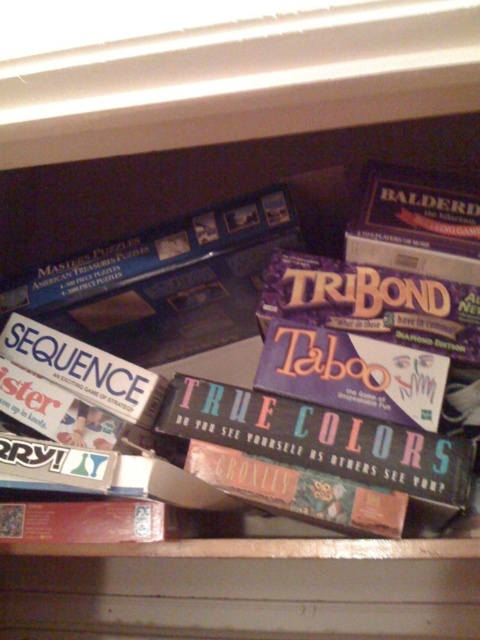
Question: Which of these objects is positioned closest to the brown cardboard box at center?

Choices:
 (A) matte cardboard true colors at center
 (B) purple cardboard game at center
 (C) matte purple board game at center

Answer: (A)

Question: Which object appears farthest from the camera in this image?

Choices:
 (A) matte cardboard true colors at center
 (B) matte purple board game at center
 (C) purple cardboard game at center
 (D) brown cardboard box at center

Answer: (C)

Question: From the image, what is the correct spatial relationship of purple cardboard game at center in relation to matte purple board game at center?

Choices:
 (A) right
 (B) left

Answer: (B)

Question: Is matte purple board game at center to the left of brown cardboard box at center from the viewer's perspective?

Choices:
 (A) no
 (B) yes

Answer: (A)

Question: Does purple cardboard game at center appear over matte purple board game at center?

Choices:
 (A) yes
 (B) no

Answer: (A)

Question: Which of the following is the farthest from the observer?

Choices:
 (A) matte cardboard true colors at center
 (B) matte purple board game at center
 (C) brown cardboard box at center

Answer: (B)